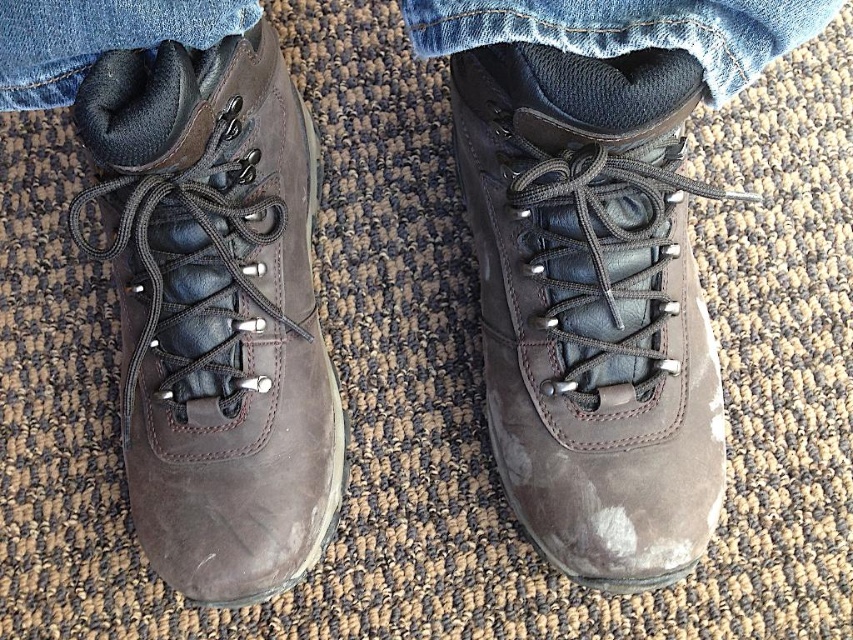
Measure the distance between brown suede boot at left and camera.

brown suede boot at left and camera are 1.11 meters apart from each other.

Does brown suede boot at left have a larger size compared to denim at left?

Indeed, brown suede boot at left has a larger size compared to denim at left.

Is point (158, 60) positioned before point (137, 26)?

No, it is not.

At what (x,y) coordinates should I click in order to perform the action: click on brown suede boot at left. Please return your answer as a coordinate pair (x, y). Looking at the image, I should click on (215, 310).

Does brown suede boot at center have a greater height compared to brown suede boot at left?

No, brown suede boot at center is not taller than brown suede boot at left.

Describe the element at coordinates (592, 305) in the screenshot. I see `brown suede boot at center` at that location.

Where is `brown suede boot at center`? This screenshot has height=640, width=853. brown suede boot at center is located at coordinates (592, 305).

What are the coordinates of `brown suede boot at left` in the screenshot? It's located at (215, 310).

Based on the photo, does brown suede boot at left have a smaller size compared to denim at center?

No.

Locate an element on the screen. The image size is (853, 640). brown suede boot at left is located at coordinates point(215,310).

You are a GUI agent. You are given a task and a screenshot of the screen. Output one action in this format:
    pyautogui.click(x=<x>, y=<y>)
    Task: Click on the brown suede boot at left
    
    Given the screenshot: What is the action you would take?
    pyautogui.click(x=215, y=310)